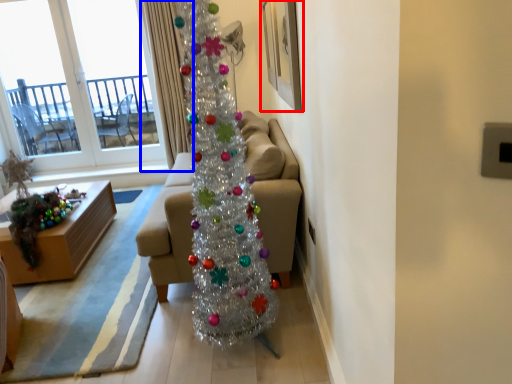
Question: Among these objects, which one is farthest to the camera, picture frame (highlighted by a red box) or curtain (highlighted by a blue box)?

Choices:
 (A) picture frame
 (B) curtain

Answer: (B)